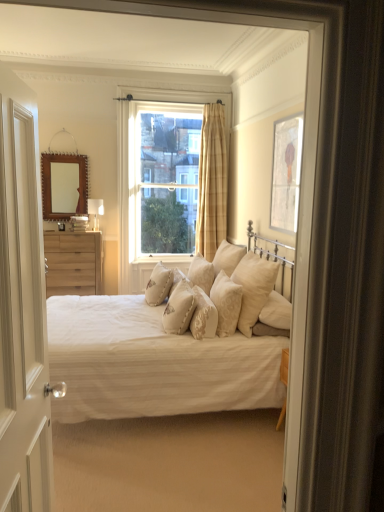
Question: Considering their positions, is plaid fabric curtain at center located in front of or behind matte silver picture frame at upper right?

Choices:
 (A) front
 (B) behind

Answer: (B)

Question: Looking at their shapes, would you say plaid fabric curtain at center is wider or thinner than matte silver picture frame at upper right?

Choices:
 (A) thin
 (B) wide

Answer: (B)

Question: Considering the real-world distances, which object is farthest from the creamy satin pillow at center, which ranks as the fourth pillow in left-to-right order?

Choices:
 (A) matte silver picture frame at upper right
 (B) plaid fabric curtain at center
 (C) creamy satin pillow at center, the 2th pillow positioned from the right
 (D) matte white bed at center
 (E) matte white lampshade at center

Answer: (B)

Question: Estimate the real-world distances between objects in this image. Which object is closer to the plaid fabric curtain at center?

Choices:
 (A) natural wood chest of drawers at left
 (B) wooden-framed mirror at upper left
 (C) matte silver picture frame at upper right
 (D) beige textured pillow at center, which ranks as the seventh pillow in right-to-left order
 (E) matte white bed at center

Answer: (C)